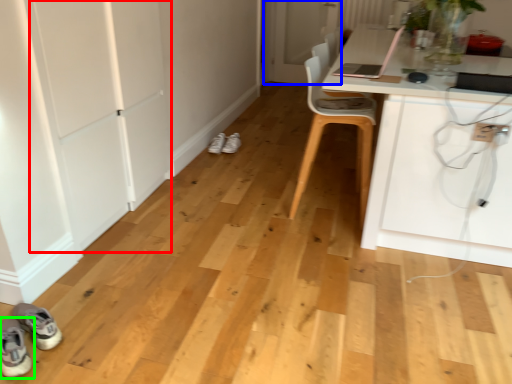
Question: Based on their relative distances, which object is farther from door (highlighted by a red box)? Choose from door (highlighted by a blue box) and footwear (highlighted by a green box).

Choices:
 (A) door
 (B) footwear

Answer: (A)